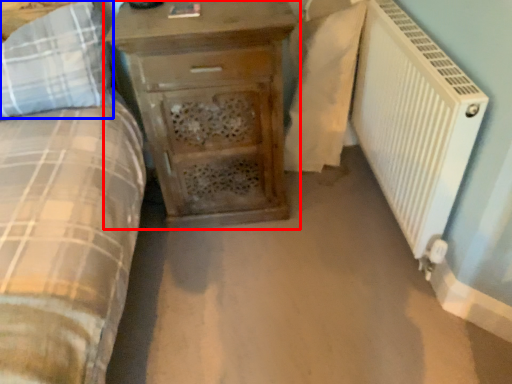
Question: Which object appears closest to the camera in this image, chest of drawers (highlighted by a red box) or pillow (highlighted by a blue box)?

Choices:
 (A) chest of drawers
 (B) pillow

Answer: (B)